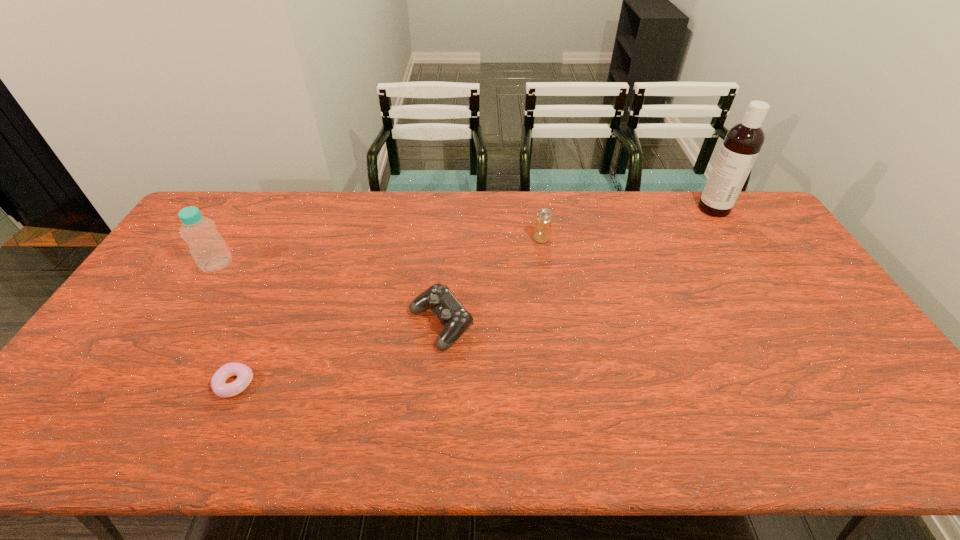
You are a GUI agent. You are given a task and a screenshot of the screen. Output one action in this format:
    pyautogui.click(x=<x>, y=<y>)
    Task: Click on the tallest object
    This screenshot has height=540, width=960.
    Given the screenshot: What is the action you would take?
    pyautogui.click(x=743, y=142)

Identify the location of the farthest object. (743, 142).

This screenshot has height=540, width=960. What are the coordinates of `the third nearest object` in the screenshot? It's located at (207, 247).

The height and width of the screenshot is (540, 960). In order to click on the leftmost object in this screenshot , I will do `click(207, 247)`.

You are a GUI agent. You are given a task and a screenshot of the screen. Output one action in this format:
    pyautogui.click(x=<x>, y=<y>)
    Task: Click on the third tallest object
    This screenshot has width=960, height=540.
    Given the screenshot: What is the action you would take?
    pyautogui.click(x=542, y=233)

Where is `saltshaker`? The height and width of the screenshot is (540, 960). saltshaker is located at coordinates (542, 233).

At what (x,y) coordinates should I click in order to perform the action: click on control. Please return your answer as a coordinate pair (x, y). Looking at the image, I should click on (456, 319).

Identify the location of the second shortest object. (456, 319).

Where is `doughnut`? The height and width of the screenshot is (540, 960). doughnut is located at coordinates point(244,374).

Identify the location of the nearest object. (244, 374).